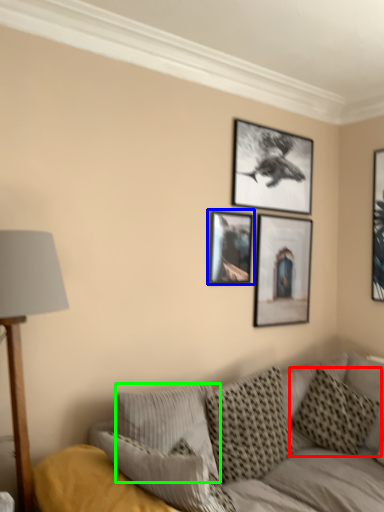
Question: Considering the real-world distances, which object is closest to pillow (highlighted by a red box)? picture frame (highlighted by a blue box) or pillow (highlighted by a green box).

Choices:
 (A) picture frame
 (B) pillow

Answer: (B)